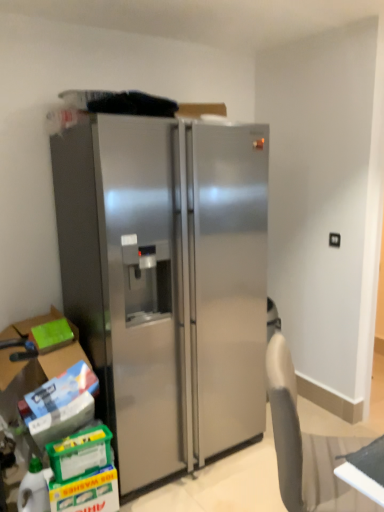
Question: Is green matte box at lower left oriented away from translucent plastic bottle at lower left?

Choices:
 (A) no
 (B) yes

Answer: (A)

Question: From the image's perspective, is green matte box at lower left located above translucent plastic bottle at lower left?

Choices:
 (A) no
 (B) yes

Answer: (B)

Question: Is green matte box at lower left surrounding translucent plastic bottle at lower left?

Choices:
 (A) no
 (B) yes

Answer: (A)

Question: From a real-world perspective, is green matte box at lower left below translucent plastic bottle at lower left?

Choices:
 (A) no
 (B) yes

Answer: (A)

Question: Is green matte box at lower left far from translucent plastic bottle at lower left?

Choices:
 (A) no
 (B) yes

Answer: (A)

Question: Is green matte box at lower left to the left of translucent plastic bottle at lower left from the viewer's perspective?

Choices:
 (A) yes
 (B) no

Answer: (A)

Question: Would you say stainless steel refrigerator at center is outside translucent plastic bottle at lower left?

Choices:
 (A) yes
 (B) no

Answer: (A)

Question: Considering the relative sizes of stainless steel refrigerator at center and translucent plastic bottle at lower left in the image provided, is stainless steel refrigerator at center taller than translucent plastic bottle at lower left?

Choices:
 (A) yes
 (B) no

Answer: (A)

Question: Considering the relative positions of stainless steel refrigerator at center and translucent plastic bottle at lower left in the image provided, is stainless steel refrigerator at center to the left of translucent plastic bottle at lower left from the viewer's perspective?

Choices:
 (A) no
 (B) yes

Answer: (A)

Question: Is translucent plastic bottle at lower left a part of stainless steel refrigerator at center?

Choices:
 (A) yes
 (B) no

Answer: (B)

Question: Can you confirm if stainless steel refrigerator at center is thinner than translucent plastic bottle at lower left?

Choices:
 (A) no
 (B) yes

Answer: (A)

Question: Considering the relative sizes of stainless steel refrigerator at center and translucent plastic bottle at lower left in the image provided, is stainless steel refrigerator at center bigger than translucent plastic bottle at lower left?

Choices:
 (A) yes
 (B) no

Answer: (A)

Question: Considering the relative sizes of green matte box at lower left and stainless steel refrigerator at center in the image provided, is green matte box at lower left thinner than stainless steel refrigerator at center?

Choices:
 (A) yes
 (B) no

Answer: (A)